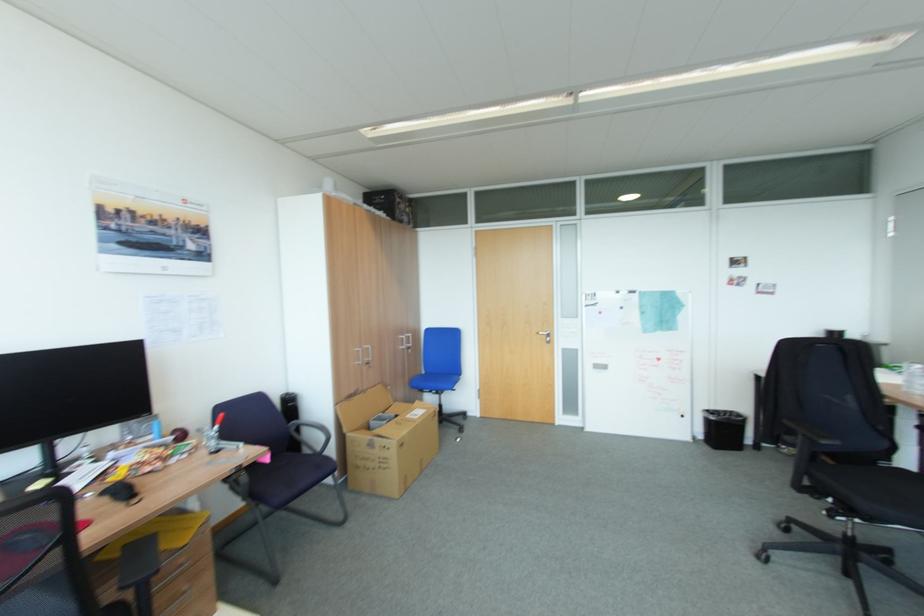
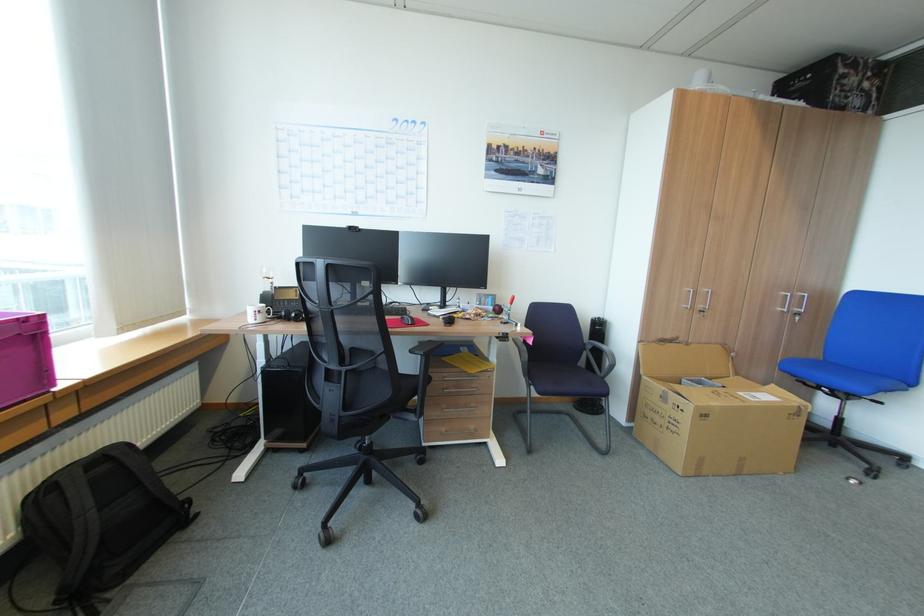
The point at (419, 403) is marked in the first image. Where is the corresponding point in the second image?

(771, 384)